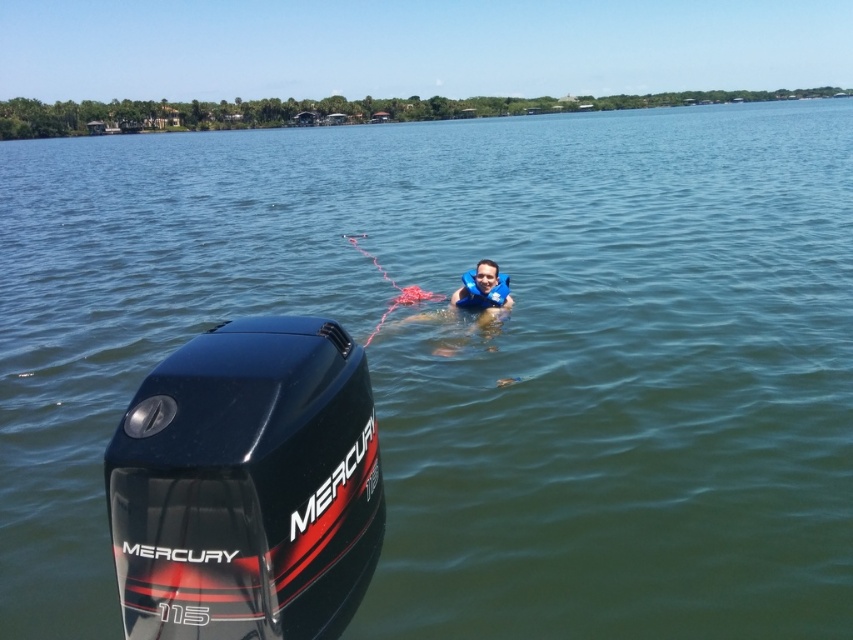
Between blue foam vest at center and blue foam life jacket at center, which one appears on the right side from the viewer's perspective?

Positioned to the right is blue foam vest at center.

Can you confirm if blue foam vest at center is positioned to the right of blue foam life jacket at center?

Correct, you'll find blue foam vest at center to the right of blue foam life jacket at center.

Locate an element on the screen. blue foam vest at center is located at coordinates (483, 292).

At what (x,y) coordinates should I click in order to perform the action: click on blue foam vest at center. Please return your answer as a coordinate pair (x, y). Looking at the image, I should click on [x=483, y=292].

Can you confirm if shiny black mercury outboard motor at lower left is shorter than blue foam life jacket at center?

Incorrect, shiny black mercury outboard motor at lower left's height does not fall short of blue foam life jacket at center's.

The image size is (853, 640). What do you see at coordinates (247, 484) in the screenshot?
I see `shiny black mercury outboard motor at lower left` at bounding box center [247, 484].

Image resolution: width=853 pixels, height=640 pixels. Describe the element at coordinates (247, 484) in the screenshot. I see `shiny black mercury outboard motor at lower left` at that location.

What are the coordinates of `shiny black mercury outboard motor at lower left` in the screenshot? It's located at (247, 484).

Does point (219, 566) come behind point (492, 320)?

No, (219, 566) is in front of (492, 320).

Describe the element at coordinates (247, 484) in the screenshot. I see `shiny black mercury outboard motor at lower left` at that location.

Who is more forward, (190, 342) or (405, 320)?

Point (190, 342) is in front.

The width and height of the screenshot is (853, 640). I want to click on shiny black mercury outboard motor at lower left, so click(x=247, y=484).